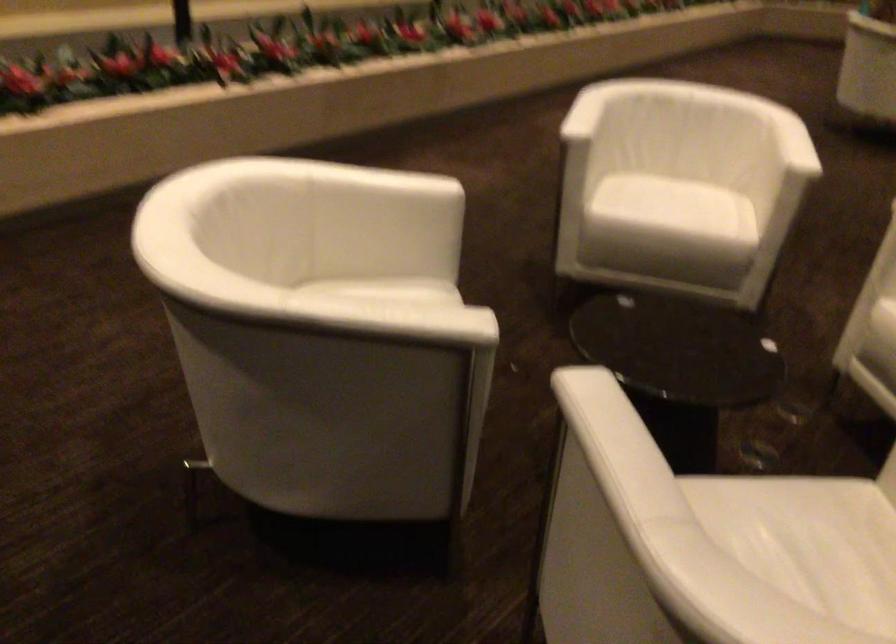
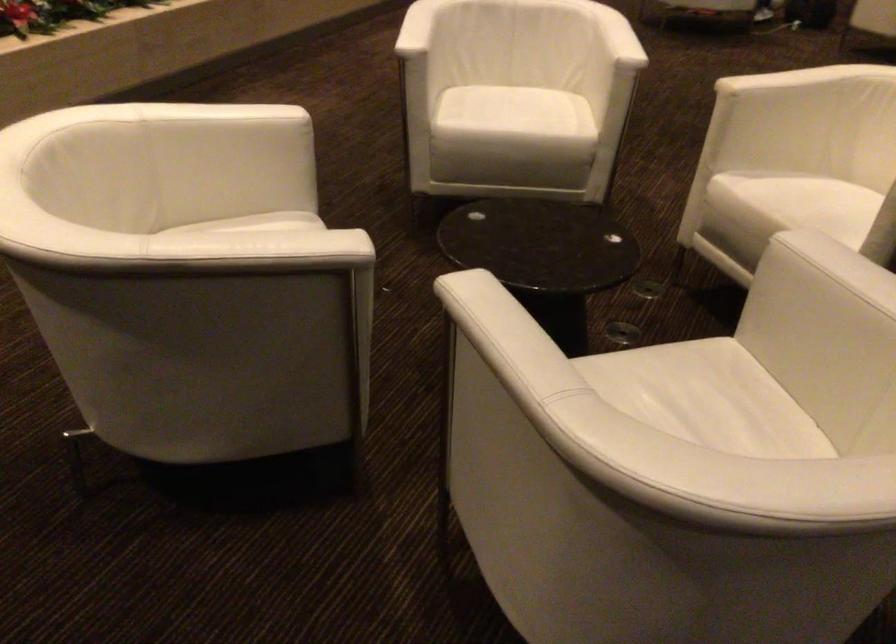
In the second image, find the point that corresponds to (790,136) in the first image.

(617, 37)